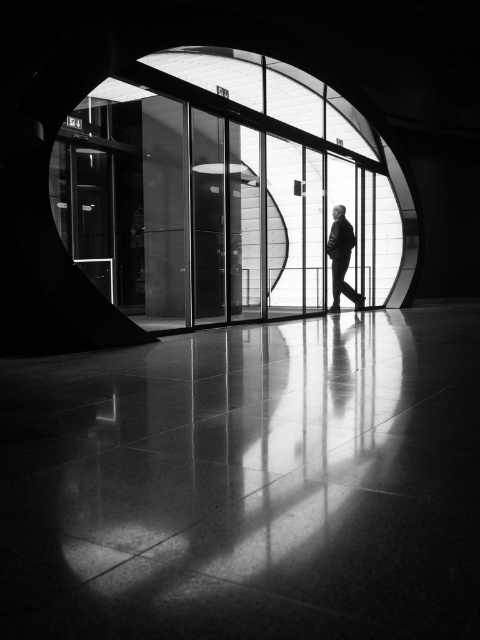
Question: Does transparent glass door at center have a lesser width compared to silhouette suit at center?

Choices:
 (A) no
 (B) yes

Answer: (B)

Question: Does transparent glass door at center have a smaller size compared to silhouette suit at center?

Choices:
 (A) no
 (B) yes

Answer: (B)

Question: Among these points, which one is farthest from the camera?

Choices:
 (A) (183, 193)
 (B) (348, 244)

Answer: (B)

Question: Which of the following is the closest to the observer?

Choices:
 (A) (348, 240)
 (B) (172, 100)

Answer: (B)

Question: Which point is farther to the camera?

Choices:
 (A) (338, 243)
 (B) (133, 300)

Answer: (B)

Question: Is transparent glass door at center above silhouette suit at center?

Choices:
 (A) no
 (B) yes

Answer: (B)